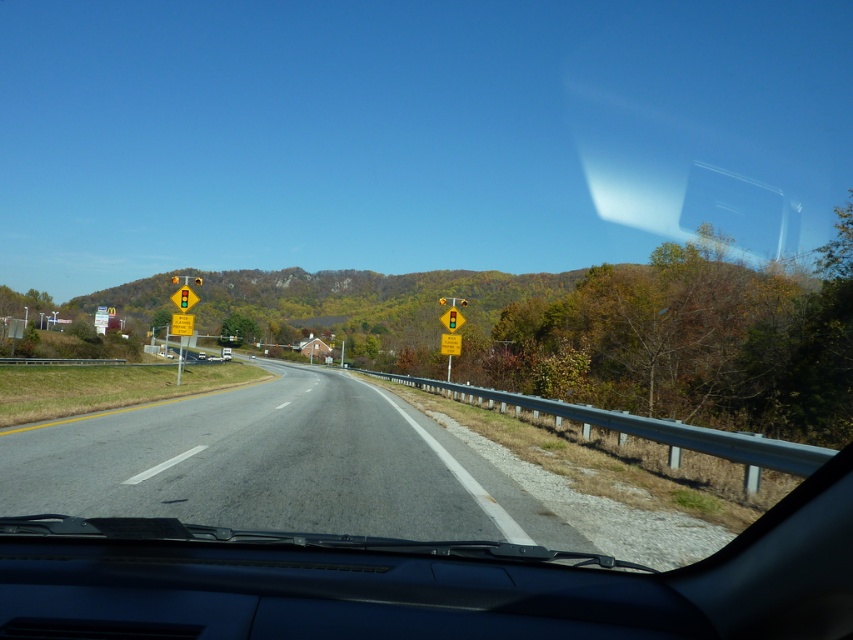
You are a driver approaching the road ahead. You notice a yellow reflective diamond at center and a yellow plastic traffic light at center. Which object is shorter in height?

The yellow reflective diamond at center has a lesser height compared to the yellow plastic traffic light at center, so the yellow reflective diamond at center is shorter.

You are driving a car and notice two yellow objects ahead on the road. The first is a yellow reflective diamond at center and the second is a yellow plastic traffic sign at center. Which one appears wider from your perspective?

The yellow reflective diamond at center appears wider than the yellow plastic traffic sign at center because its width is larger.

You are driving a car and looking through the windshield. You see a yellow plastic traffic sign at center and a yellow plastic traffic light at center. Which one is closer to the road?

The yellow plastic traffic sign at center is closer to the road because it is positioned below the yellow plastic traffic light at center, indicating it is lower and nearer to the road level.